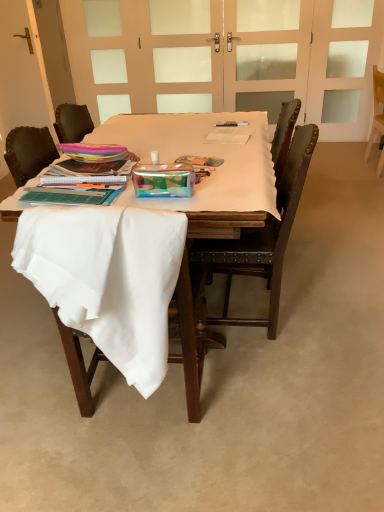
This screenshot has height=512, width=384. I want to click on empty space that is ontop of white fabric-covered desk at center, so click(x=200, y=140).